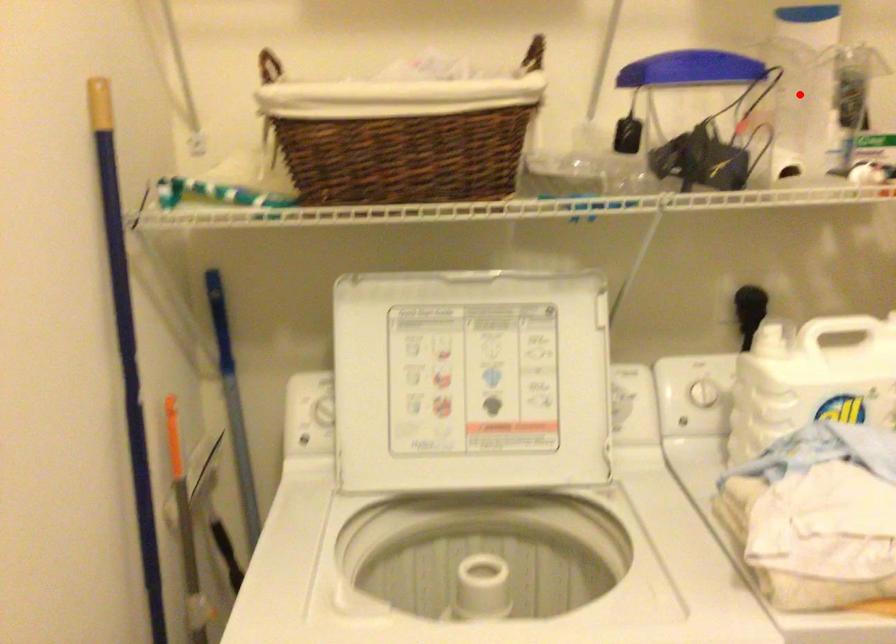
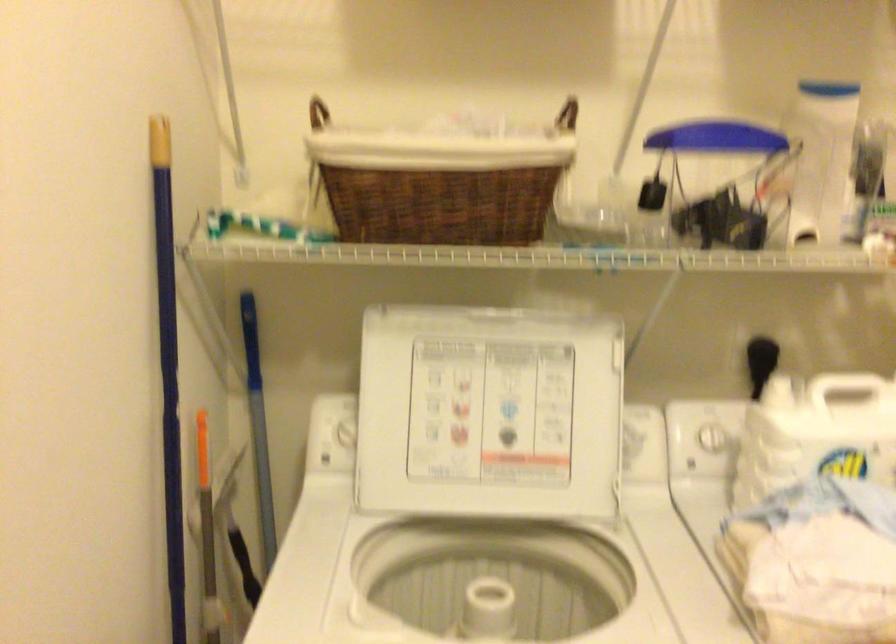
In the second image, find the point that corresponds to the highlighted location in the first image.

(821, 158)